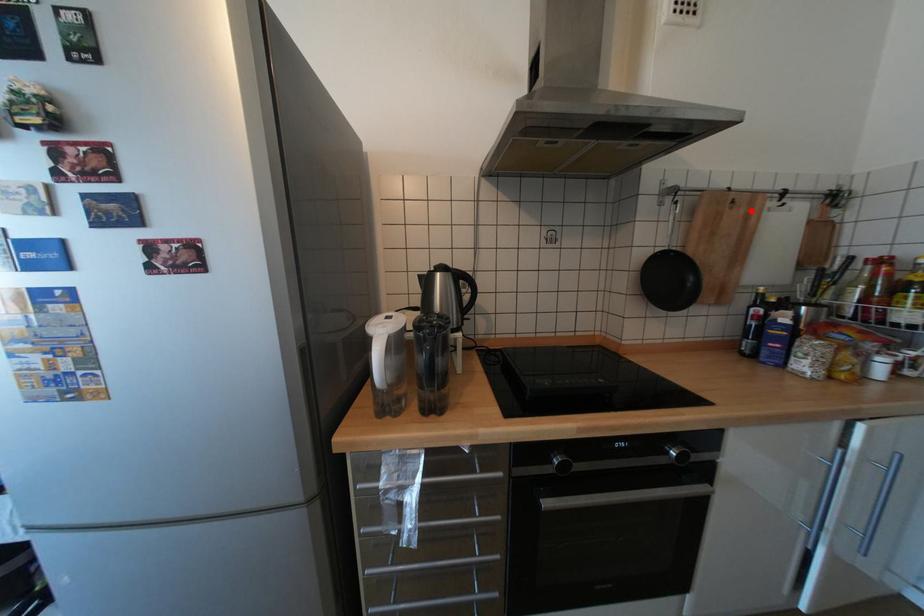
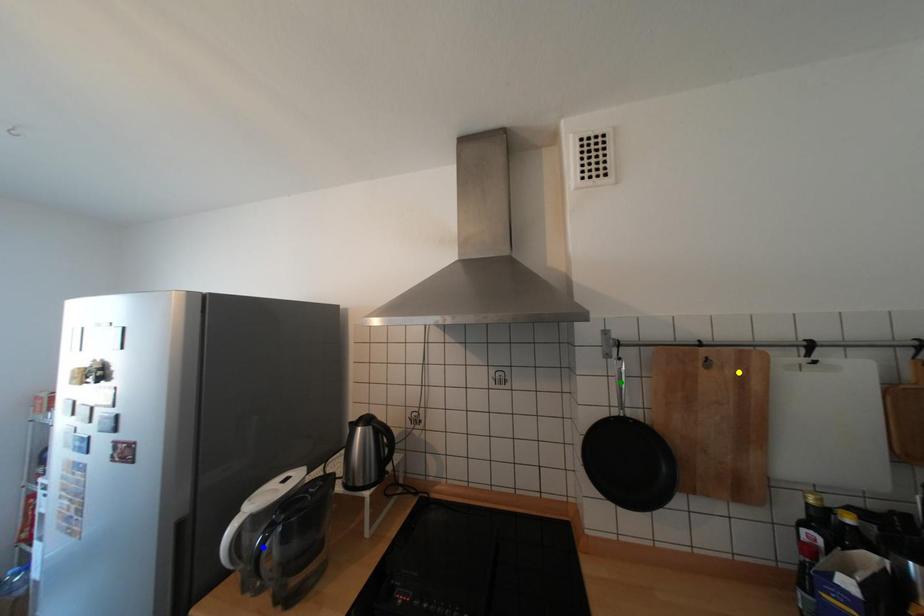
Question: I am providing you with two images of the same scene from different viewpoints. A red point is marked on the first image. You are given multiple points on the second image. In image 2, which mark is for the same physical point as the one in image 1?

Choices:
 (A) blue point
 (B) green point
 (C) yellow point

Answer: (C)